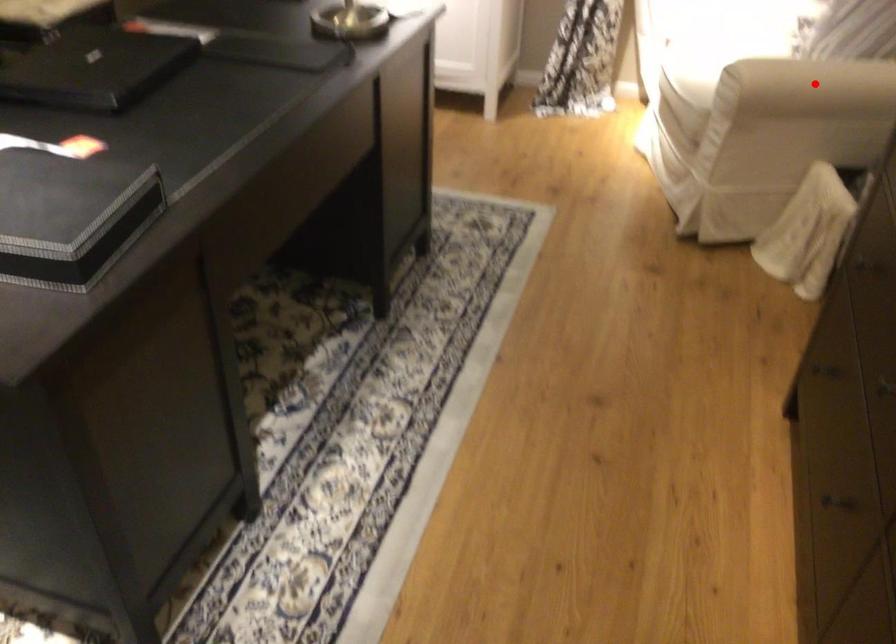
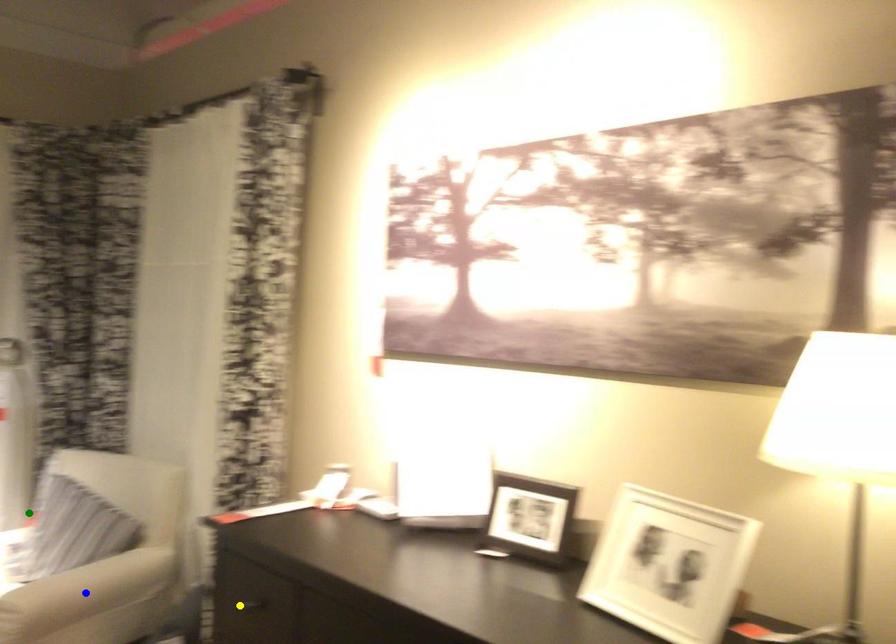
Question: I am providing you with two images of the same scene from different viewpoints. A red point is marked on the first image. You are given multiple points on the second image. In image 2, which mark is for the same physical point as the one in image 1?

Choices:
 (A) blue point
 (B) green point
 (C) yellow point

Answer: (A)